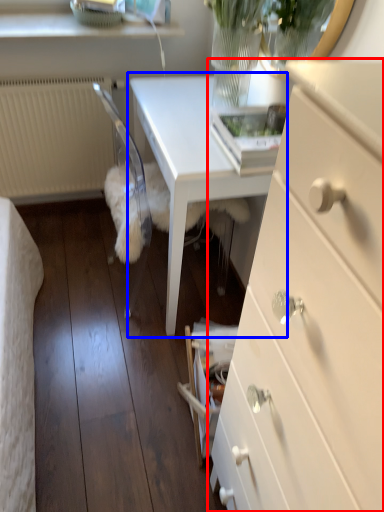
Question: Which of the following is the closest to the observer, chest of drawers (highlighted by a red box) or table (highlighted by a blue box)?

Choices:
 (A) chest of drawers
 (B) table

Answer: (A)